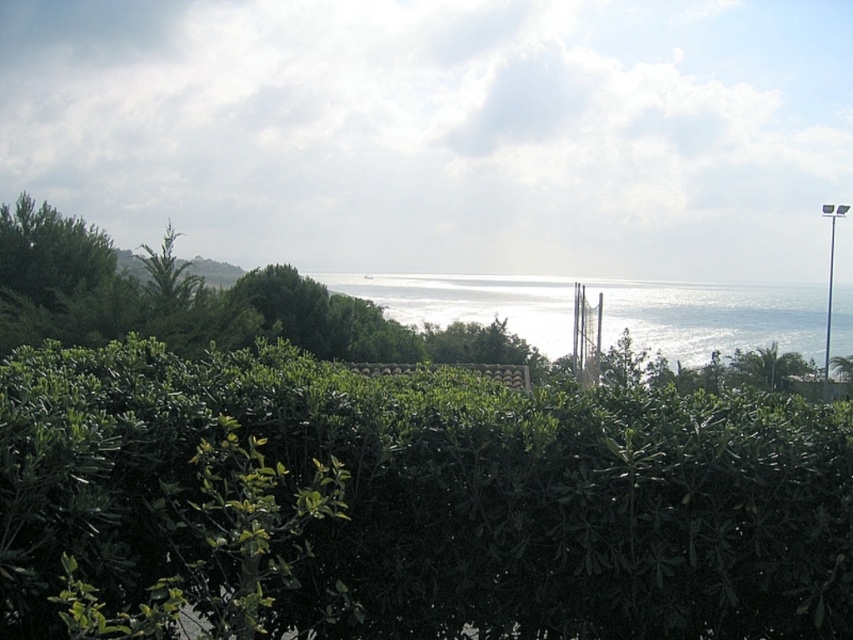
You are a gardener who wants to trim the green leafy hedge at center so it reaches the same height as the glistening silver water at center. Based on the scene, is this possible?

The green leafy hedge at center is not as tall as the glistening silver water at center, so it is not possible to trim the hedge to match the water height since water level cannot be altered by trimming.

You are standing at the center of the image and want to walk towards the green leafy hedge at center. Which direction should you move?

The green leafy hedge at center is located at point (410,502) in 2D coordinates, so you should move towards the lower right direction to reach it.

You are a landscape architect planning to install a walkway between the green leafy hedge at center and the glistening silver water at center. The walkway requires a minimum clearance of 150 feet between the two points. Is the available distance sufficient?

The distance between the green leafy hedge at center and the glistening silver water at center is 163.79 feet, which exceeds the required 150 feet clearance. Therefore, the available distance is sufficient for the walkway.